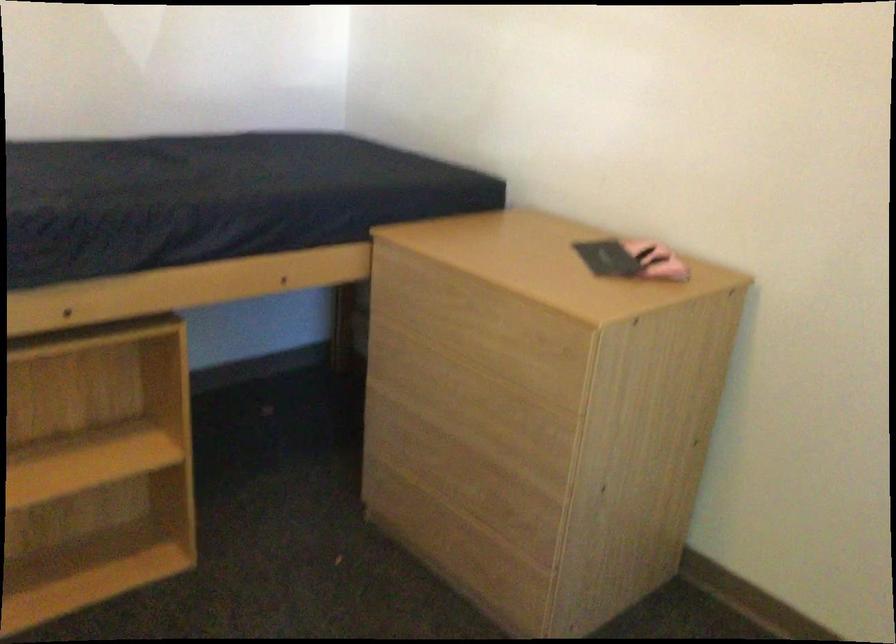
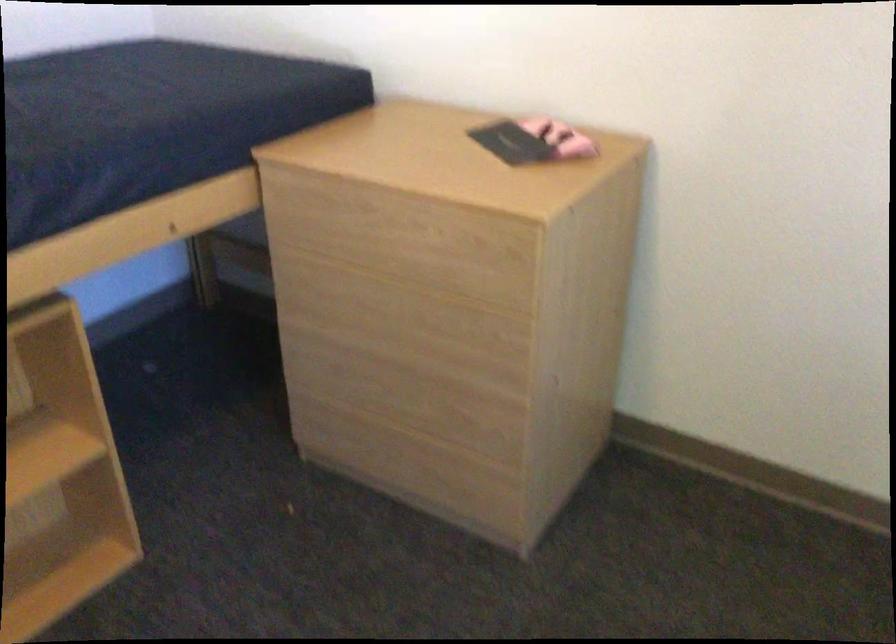
Locate, in the second image, the point that corresponds to point 470,411 in the first image.

(410, 327)